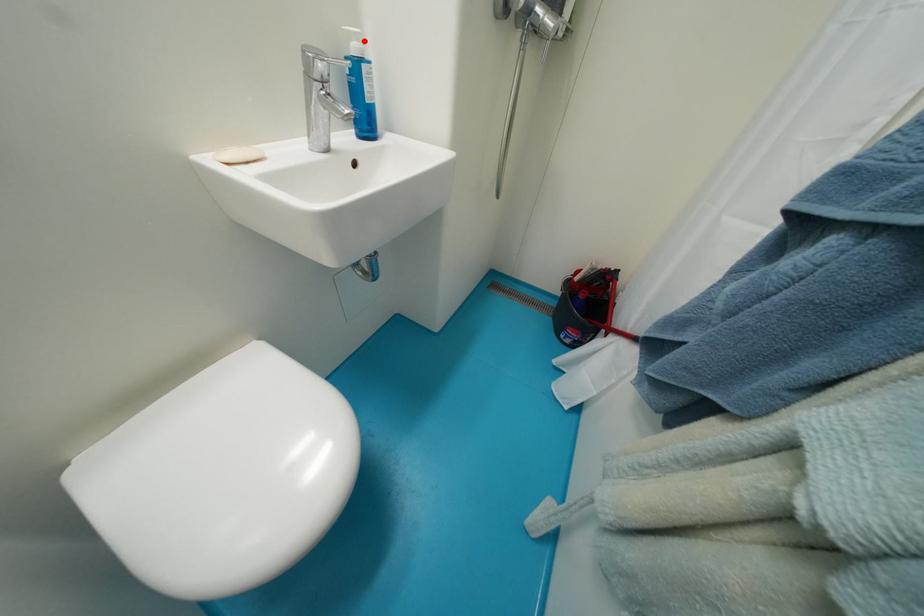
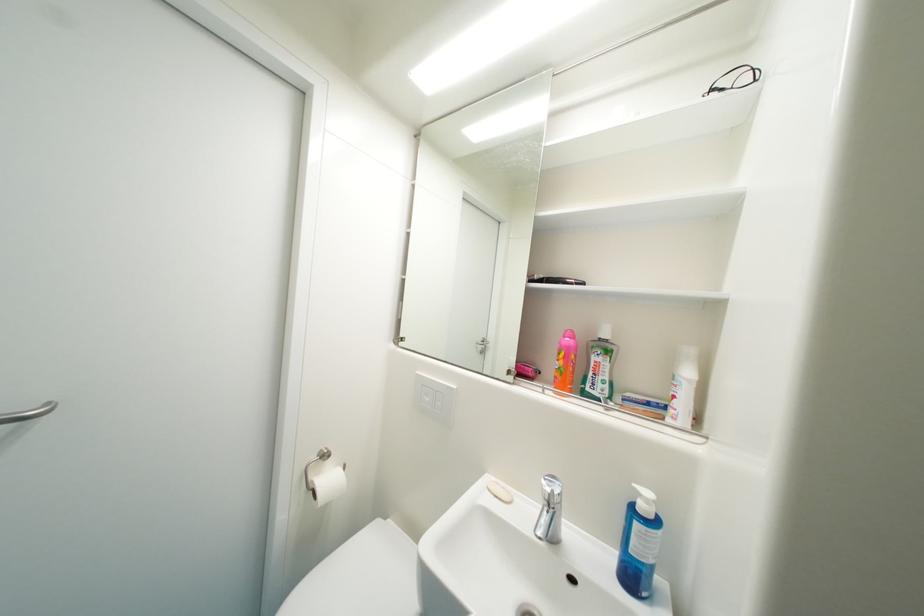
Locate, in the second image, the point that corresponds to the highlighted location in the first image.

(653, 503)